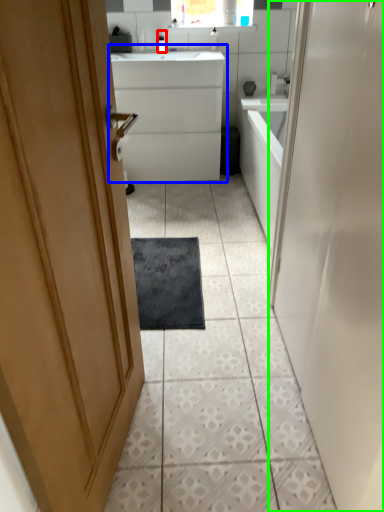
Question: Based on their relative distances, which object is farther from toiletry (highlighted by a red box)? Choose from bathroom cabinet (highlighted by a blue box) and door (highlighted by a green box).

Choices:
 (A) bathroom cabinet
 (B) door

Answer: (B)